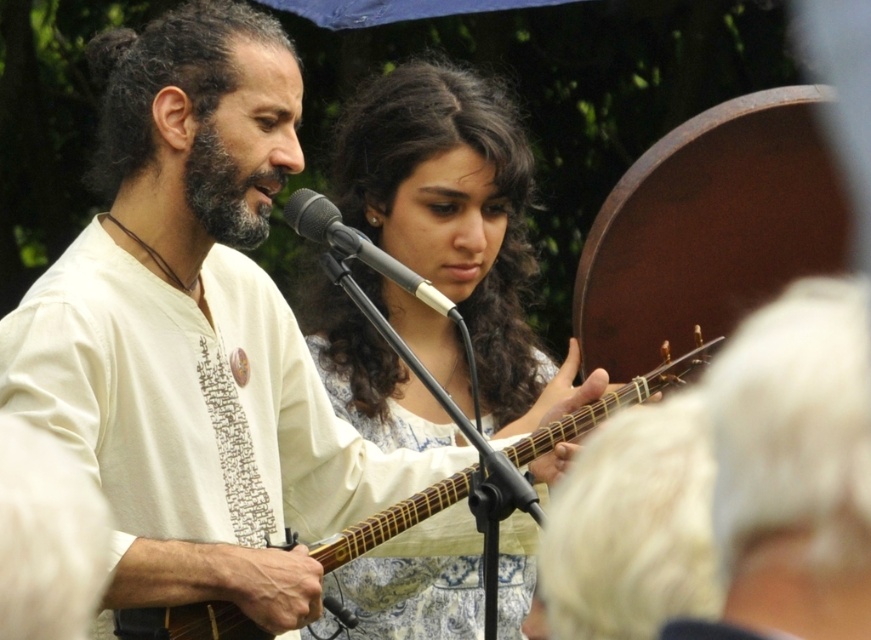
Which is more to the left, wooden acoustic guitar at center or black matte microphone at center?

black matte microphone at center is more to the left.

Does wooden acoustic guitar at center appear on the right side of black matte microphone at center?

Indeed, wooden acoustic guitar at center is positioned on the right side of black matte microphone at center.

Measure the distance between point (562, 435) and camera.

Point (562, 435) is 3.18 meters away from camera.

Locate an element on the screen. wooden acoustic guitar at center is located at coordinates (618, 397).

Measure the distance between bearddark brown/thickfacial hair at left and black matte microphone at center.

bearddark brown/thickfacial hair at left is 7.22 inches from black matte microphone at center.

Looking at this image, who is taller, bearddark brown/thickfacial hair at left or black matte microphone at center?

black matte microphone at center

What do you see at coordinates (225, 192) in the screenshot? I see `bearddark brown/thickfacial hair at left` at bounding box center [225, 192].

Locate an element on the screen. The image size is (871, 640). bearddark brown/thickfacial hair at left is located at coordinates (225, 192).

Who is positioned more to the right, light brown wood guitar at center or bearddark brown/thickfacial hair at left?

light brown wood guitar at center is more to the right.

Which is behind, point (503, 307) or point (241, 177)?

The point (503, 307) is more distant.

The width and height of the screenshot is (871, 640). I want to click on light brown wood guitar at center, so click(451, 230).